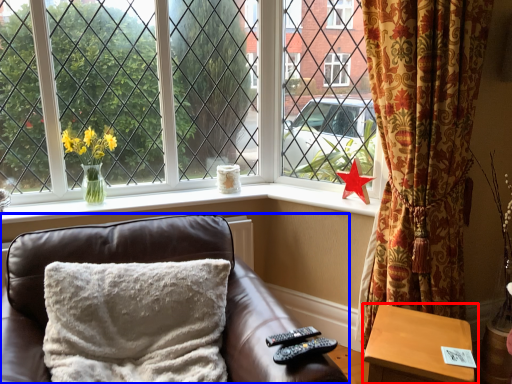
Question: Which object is closer to the camera taking this photo, table (highlighted by a red box) or furniture (highlighted by a blue box)?

Choices:
 (A) table
 (B) furniture

Answer: (B)